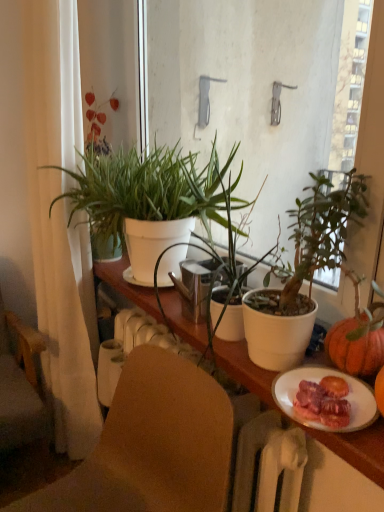
Question: From a real-world perspective, does green matte plant at center, which is counted as the first houseplant, starting from the front, sit lower than white fabric curtain at left?

Choices:
 (A) yes
 (B) no

Answer: (B)

Question: Is green matte plant at center, which is the 2th houseplant in back-to-front order, thinner than white fabric curtain at left?

Choices:
 (A) no
 (B) yes

Answer: (A)

Question: Does green matte plant at center, which is counted as the first houseplant, starting from the front, lie behind white fabric curtain at left?

Choices:
 (A) yes
 (B) no

Answer: (B)

Question: Is green matte plant at center, which is the 2th houseplant in back-to-front order, oriented away from white fabric curtain at left?

Choices:
 (A) no
 (B) yes

Answer: (A)

Question: Is green matte plant at center, which is the 2th houseplant in back-to-front order, wider than white fabric curtain at left?

Choices:
 (A) no
 (B) yes

Answer: (B)

Question: Looking at their shapes, would you say white fabric curtain at left is wider or thinner than wooden chair at left, the second chair viewed from the right?

Choices:
 (A) thin
 (B) wide

Answer: (A)

Question: In the image, is white fabric curtain at left on the left side or the right side of wooden chair at left, the 1th chair from the left?

Choices:
 (A) left
 (B) right

Answer: (B)

Question: Considering their positions, is white fabric curtain at left located in front of or behind wooden chair at left, the first chair from the back?

Choices:
 (A) front
 (B) behind

Answer: (A)

Question: Based on their sizes in the image, would you say white fabric curtain at left is bigger or smaller than wooden chair at left, the second chair viewed from the right?

Choices:
 (A) small
 (B) big

Answer: (A)

Question: Is wooden chair at left, the 1th chair from the left, in front of or behind white matte plant pot at center, positioned as the first houseplant in back-to-front order, in the image?

Choices:
 (A) behind
 (B) front

Answer: (A)

Question: Is wooden chair at left, the 1th chair from the left, wider or thinner than white matte plant pot at center, which is counted as the 2th houseplant, starting from the front?

Choices:
 (A) thin
 (B) wide

Answer: (B)

Question: Which is correct: wooden chair at left, the second chair viewed from the right, is inside white matte plant pot at center, which is counted as the 2th houseplant, starting from the front, or outside of it?

Choices:
 (A) outside
 (B) inside

Answer: (A)

Question: Visually, is wooden chair at left, the first chair from the back, positioned to the left or to the right of white matte plant pot at center, which is counted as the 2th houseplant, starting from the front?

Choices:
 (A) right
 (B) left

Answer: (B)

Question: Considering their positions, is white matte cabinet at center located in front of or behind green matte plant at center, which is the 2th houseplant in back-to-front order?

Choices:
 (A) front
 (B) behind

Answer: (A)

Question: From a real-world perspective, is white matte cabinet at center physically located above or below green matte plant at center, which is counted as the first houseplant, starting from the front?

Choices:
 (A) above
 (B) below

Answer: (B)